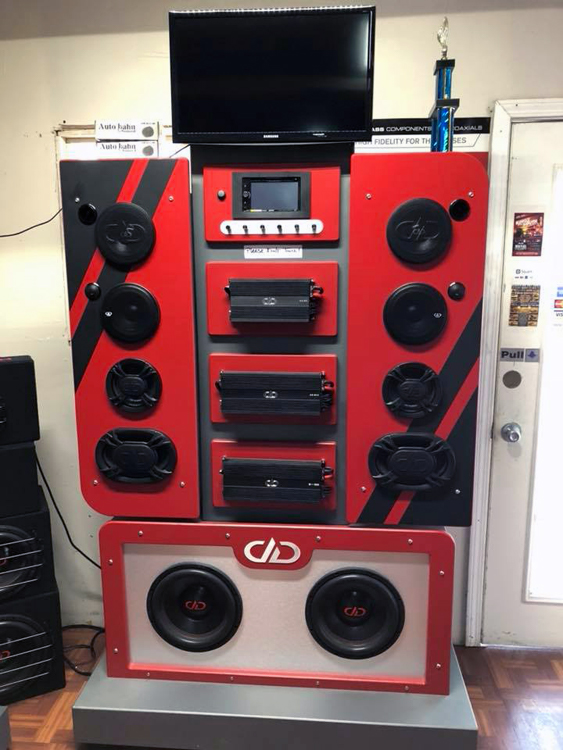
At what (x,y) coordinates should I click in order to perform the action: click on flatscreen tv. Please return your answer as a coordinate pair (x, y). Looking at the image, I should click on (325, 50).